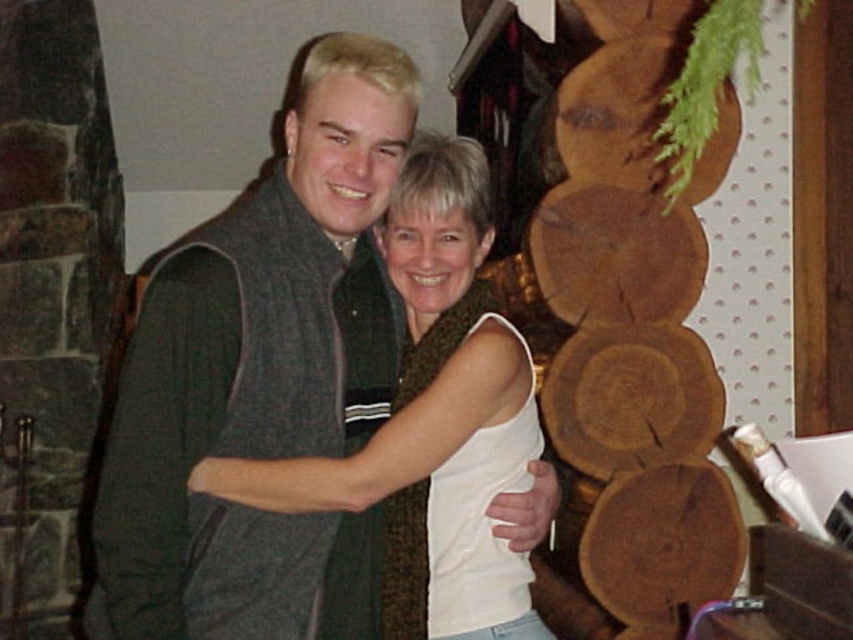
Question: Is dark gray sweater vest at center to the right of white textured tank top at center from the viewer's perspective?

Choices:
 (A) no
 (B) yes

Answer: (A)

Question: Is dark gray sweater vest at center behind white textured tank top at center?

Choices:
 (A) yes
 (B) no

Answer: (B)

Question: Is dark gray sweater vest at center wider than white textured tank top at center?

Choices:
 (A) no
 (B) yes

Answer: (B)

Question: Which point is closer to the camera taking this photo?

Choices:
 (A) [239, 406]
 (B) [425, 237]

Answer: (A)